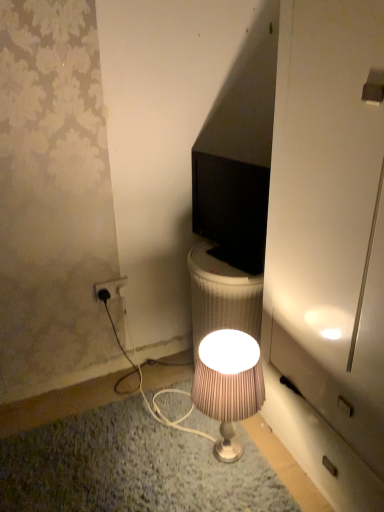
Question: Is black glossy monitor at center surrounding white plastic power outlet at lower left?

Choices:
 (A) yes
 (B) no

Answer: (B)

Question: Is the position of black glossy monitor at center more distant than that of white plastic power outlet at lower left?

Choices:
 (A) no
 (B) yes

Answer: (A)

Question: Is black glossy monitor at center facing away from white plastic power outlet at lower left?

Choices:
 (A) yes
 (B) no

Answer: (B)

Question: Is black glossy monitor at center thinner than white plastic power outlet at lower left?

Choices:
 (A) no
 (B) yes

Answer: (A)

Question: Is black glossy monitor at center oriented towards white plastic power outlet at lower left?

Choices:
 (A) yes
 (B) no

Answer: (B)

Question: Is black glossy monitor at center taller than white plastic power outlet at lower left?

Choices:
 (A) yes
 (B) no

Answer: (A)

Question: Can you confirm if white plastic power outlet at lower left is bigger than black glossy monitor at center?

Choices:
 (A) no
 (B) yes

Answer: (A)

Question: Considering the relative sizes of white plastic power outlet at lower left and black glossy monitor at center in the image provided, is white plastic power outlet at lower left smaller than black glossy monitor at center?

Choices:
 (A) yes
 (B) no

Answer: (A)

Question: From a real-world perspective, is white plastic power outlet at lower left below black glossy monitor at center?

Choices:
 (A) no
 (B) yes

Answer: (B)

Question: Does white plastic power outlet at lower left appear on the right side of black glossy monitor at center?

Choices:
 (A) no
 (B) yes

Answer: (A)

Question: Is white plastic power outlet at lower left not inside black glossy monitor at center?

Choices:
 (A) yes
 (B) no

Answer: (A)

Question: Is white plastic power outlet at lower left far away from black glossy monitor at center?

Choices:
 (A) no
 (B) yes

Answer: (A)

Question: Is silky beige lampshade at center at the right side of white plastic power outlet at lower left?

Choices:
 (A) yes
 (B) no

Answer: (A)